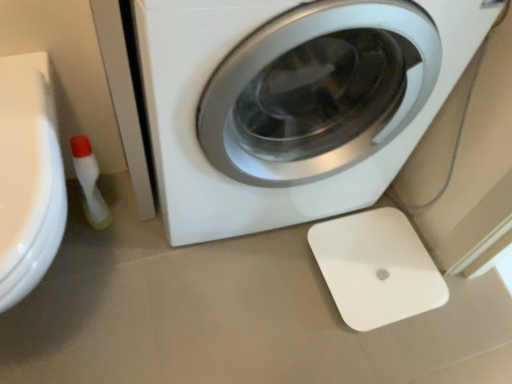
Locate an element on the screen. This screenshot has width=512, height=384. vacant area that is in front of translucent plastic bottle at lower left is located at coordinates (91, 273).